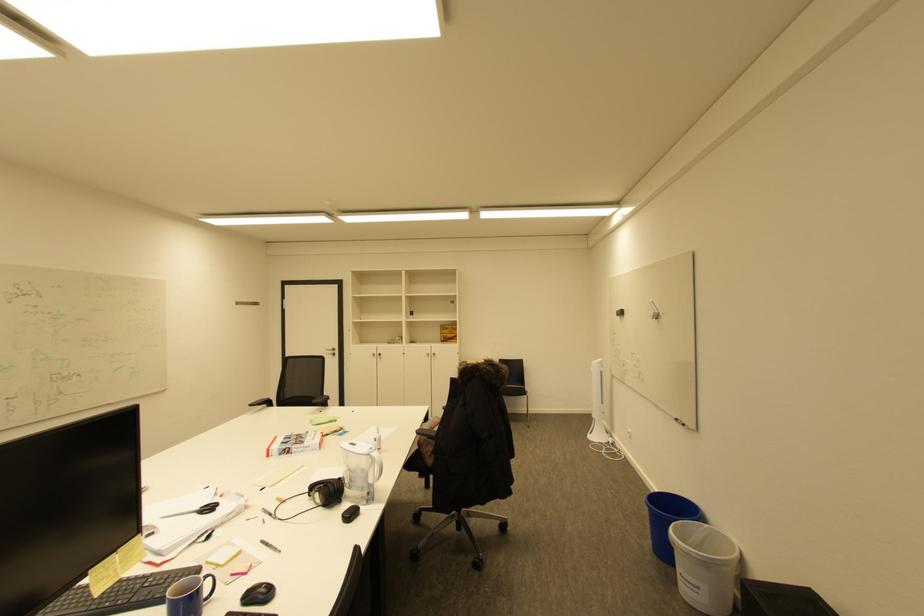
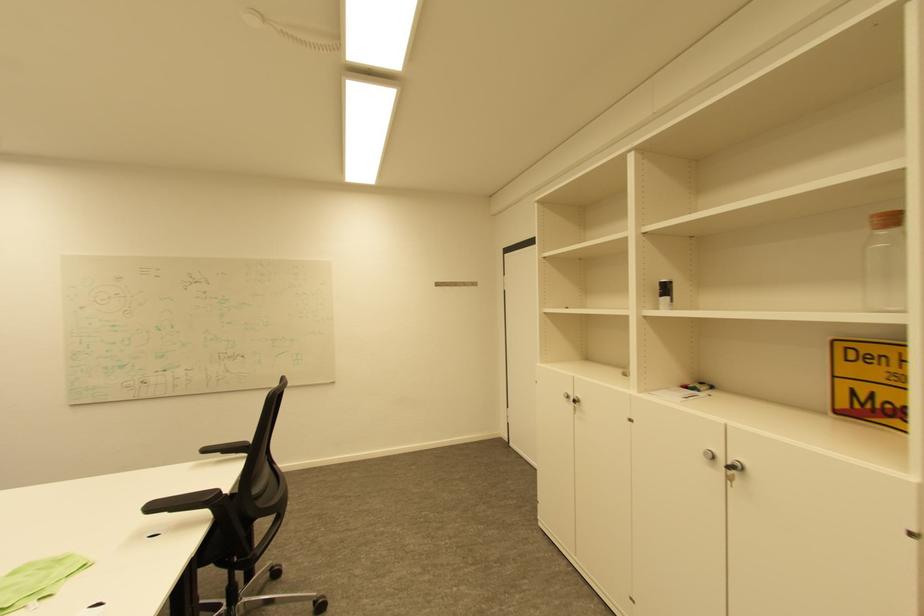
The point at [258,406] is marked in the first image. Where is the corresponding point in the second image?

(213, 450)